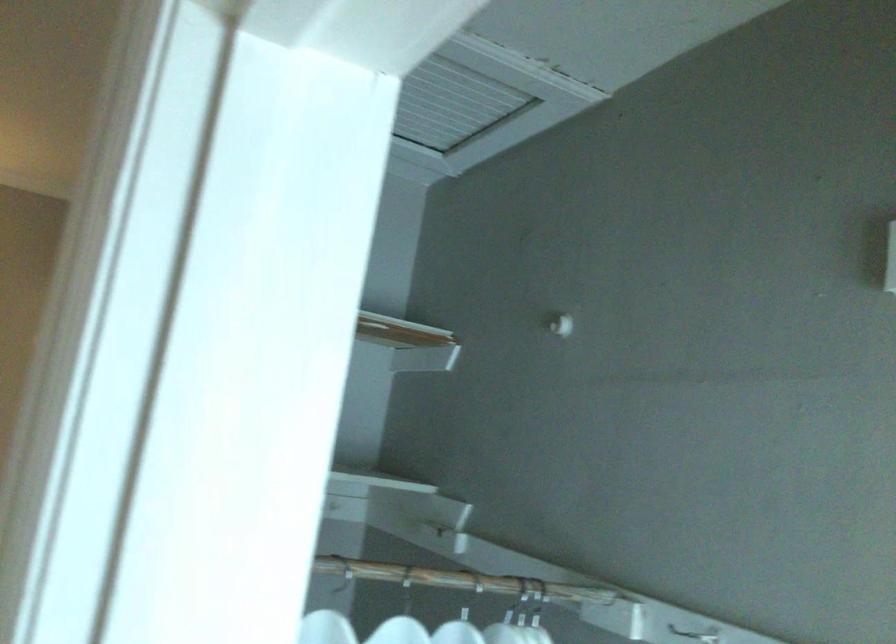
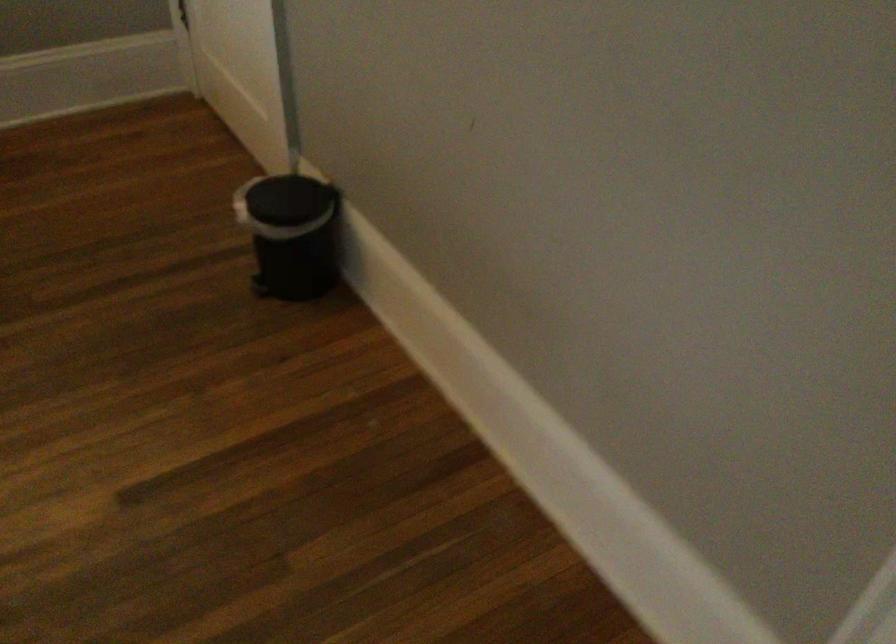
Question: The images are taken continuously from a first-person perspective. In which direction is your viewpoint rotating?

Choices:
 (A) Left
 (B) Right
 (C) Up
 (D) Down

Answer: (D)